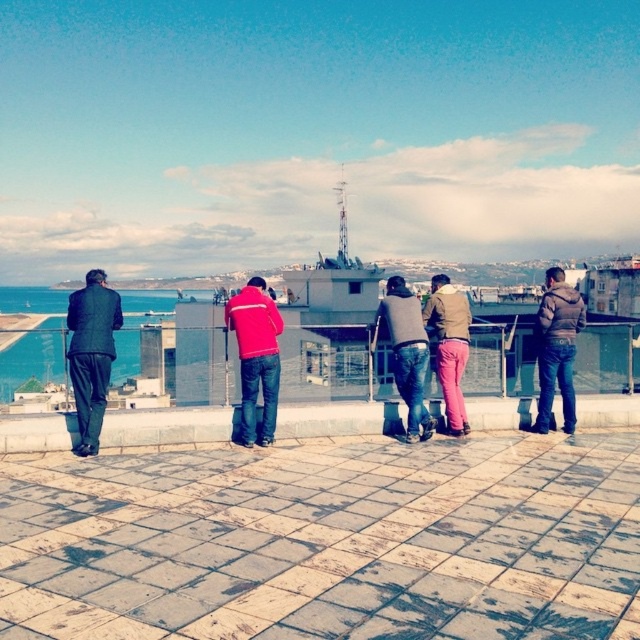
Between brown leather jacket at right and denim jeans at center, which one is positioned lower?

brown leather jacket at right is below.

Is point (564, 316) behind point (400, 307)?

Yes, point (564, 316) is farther from viewer.

Who is more forward, (544, 364) or (426, 432)?

Positioned in front is point (426, 432).

Identify the location of brown leather jacket at right. (556, 348).

Is dark gray suit at left behind brown leather jacket at right?

No.

Can you confirm if dark gray suit at left is positioned to the left of brown leather jacket at right?

A: Yes, dark gray suit at left is to the left of brown leather jacket at right.

Find the location of a particular element. Image resolution: width=640 pixels, height=640 pixels. dark gray suit at left is located at coordinates (92, 353).

Can you confirm if dark gray suit at left is positioned below red fleece jacket at center?

Indeed, dark gray suit at left is positioned under red fleece jacket at center.

Who is higher up, dark gray suit at left or red fleece jacket at center?

red fleece jacket at center

Locate an element on the screen. dark gray suit at left is located at coordinates (x=92, y=353).